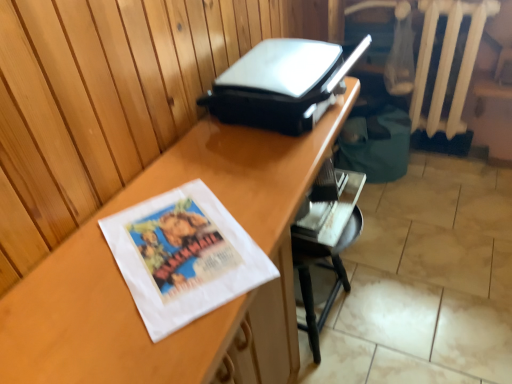
Find the location of a particular element. white painted wood radiator at upper right is located at coordinates (447, 61).

Describe the element at coordinates (326, 246) in the screenshot. The image size is (512, 384). I see `metallic silver chair at lower right` at that location.

This screenshot has height=384, width=512. What do you see at coordinates (130, 293) in the screenshot?
I see `wooden desk at center` at bounding box center [130, 293].

What are the coordinates of `white painted wood radiator at upper right` in the screenshot? It's located at (447, 61).

Considering the sizes of objects metallic silver chair at lower right and wooden desk at center in the image provided, who is wider, metallic silver chair at lower right or wooden desk at center?

Wider between the two is wooden desk at center.

Based on their sizes in the image, would you say metallic silver chair at lower right is bigger or smaller than wooden desk at center?

In the image, metallic silver chair at lower right appears to be smaller than wooden desk at center.

In the scene shown: Is metallic silver chair at lower right outside of wooden desk at center?

No, metallic silver chair at lower right is inside or overlapping with wooden desk at center.

How many degrees apart are the facing directions of white painted wood radiator at upper right and metallic silver chair at lower right?

90.6 degrees separate the facing orientations of white painted wood radiator at upper right and metallic silver chair at lower right.

From the image's perspective, who appears lower, white painted wood radiator at upper right or metallic silver chair at lower right?

metallic silver chair at lower right is shown below in the image.

Is white painted wood radiator at upper right far from metallic silver chair at lower right?

They are positioned close to each other.

Which point is more forward, (421, 82) or (339, 212)?

The point (339, 212) is in front.

Is white painted wood radiator at upper right taller than wooden desk at center?

In fact, white painted wood radiator at upper right may be shorter than wooden desk at center.

Does white painted wood radiator at upper right turn towards wooden desk at center?

Yes, white painted wood radiator at upper right is turned towards wooden desk at center.

This screenshot has height=384, width=512. In order to click on desk that appears on the left of white painted wood radiator at upper right in this screenshot , I will do `click(130, 293)`.

From the picture: Is white painted wood radiator at upper right next to wooden desk at center and touching it?

No, white painted wood radiator at upper right is not beside wooden desk at center.

Can you confirm if wooden desk at center is taller than metallic silver chair at lower right?

Yes.

From a real-world perspective, is wooden desk at center physically above metallic silver chair at lower right?

Yes, from a real-world perspective, wooden desk at center is above metallic silver chair at lower right.

Considering the relative positions of wooden desk at center and metallic silver chair at lower right in the image provided, is wooden desk at center to the left of metallic silver chair at lower right from the viewer's perspective?

Indeed, wooden desk at center is positioned on the left side of metallic silver chair at lower right.

Considering the relative sizes of wooden desk at center and metallic silver chair at lower right in the image provided, is wooden desk at center wider than metallic silver chair at lower right?

Yes.

From a real-world perspective, between wooden desk at center and white painted wood radiator at upper right, who is vertically lower?

wooden desk at center is physically lower.

Is wooden desk at center placed right next to white painted wood radiator at upper right?

They are not placed beside each other.

Is wooden desk at center thinner than white painted wood radiator at upper right?

No, wooden desk at center is not thinner than white painted wood radiator at upper right.

From the image's perspective, is wooden desk at center positioned above or below white painted wood radiator at upper right?

Based on their image positions, wooden desk at center is located beneath white painted wood radiator at upper right.

Considering the points (316, 344) and (464, 56), which point is in front, point (316, 344) or point (464, 56)?

The point (316, 344) is more forward.

Looking at this image, is metallic silver chair at lower right outside of white painted wood radiator at upper right?

Yes, metallic silver chair at lower right is outside of white painted wood radiator at upper right.

Is metallic silver chair at lower right facing away from white painted wood radiator at upper right?

That's not correct — metallic silver chair at lower right is not looking away from white painted wood radiator at upper right.

How different are the orientations of metallic silver chair at lower right and white painted wood radiator at upper right in degrees?

The angular difference between metallic silver chair at lower right and white painted wood radiator at upper right is 90.6 degrees.

In order to click on desk located on the left of metallic silver chair at lower right in this screenshot , I will do `click(130, 293)`.

What are the coordinates of `radiator that is above the metallic silver chair at lower right (from a real-world perspective)` in the screenshot? It's located at (447, 61).

Estimate the real-world distances between objects in this image. Which object is closer to metallic silver chair at lower right, white painted wood radiator at upper right or wooden desk at center?

Among the two, wooden desk at center is located nearer to metallic silver chair at lower right.

Consider the image. Based on their spatial positions, is white painted wood radiator at upper right or metallic silver chair at lower right closer to wooden desk at center?

metallic silver chair at lower right lies closer to wooden desk at center than the other object.

Estimate the real-world distances between objects in this image. Which object is closer to white painted wood radiator at upper right, wooden desk at center or metallic silver chair at lower right?

metallic silver chair at lower right.

Looking at the image, which one is located closer to wooden desk at center, metallic silver chair at lower right or white painted wood radiator at upper right?

metallic silver chair at lower right lies closer to wooden desk at center than the other object.

Looking at the image, which one is located further to metallic silver chair at lower right, wooden desk at center or white painted wood radiator at upper right?

white painted wood radiator at upper right is positioned further to the anchor metallic silver chair at lower right.

Looking at the image, which one is located closer to white painted wood radiator at upper right, metallic silver chair at lower right or wooden desk at center?

The object closer to white painted wood radiator at upper right is metallic silver chair at lower right.

Where is `furniture positioned between wooden desk at center and white painted wood radiator at upper right from near to far`? furniture positioned between wooden desk at center and white painted wood radiator at upper right from near to far is located at coordinates point(326,246).